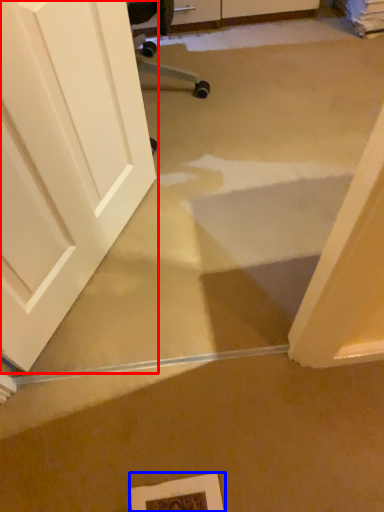
Question: Which point is closer to the camera, door (highlighted by a red box) or picture frame (highlighted by a blue box)?

Choices:
 (A) door
 (B) picture frame

Answer: (A)